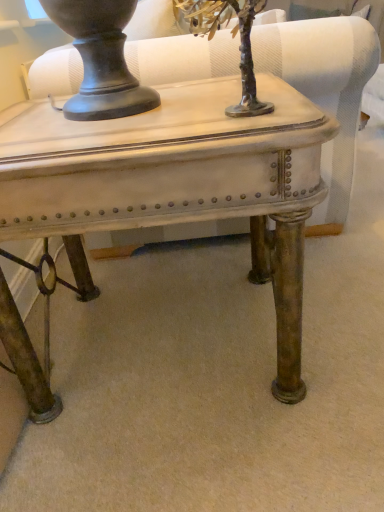
The width and height of the screenshot is (384, 512). I want to click on vacant space that is to the left of metallic silver tree at upper center, so click(87, 125).